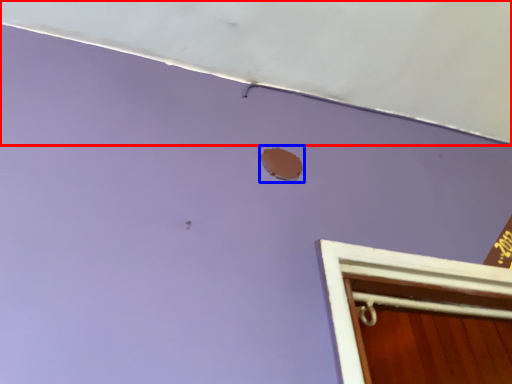
Question: Among these objects, which one is nearest to the camera, exhaust hood (highlighted by a red box) or hole (highlighted by a blue box)?

Choices:
 (A) exhaust hood
 (B) hole

Answer: (A)